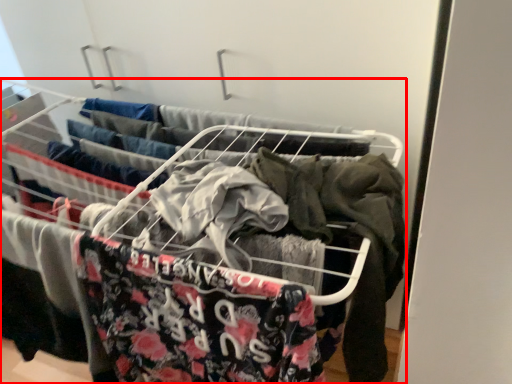
Question: From the image's perspective, considering the relative positions of furniture (annotated by the red box) and clothing in the image provided, where is furniture (annotated by the red box) located with respect to the staircase?

Choices:
 (A) above
 (B) below

Answer: (B)